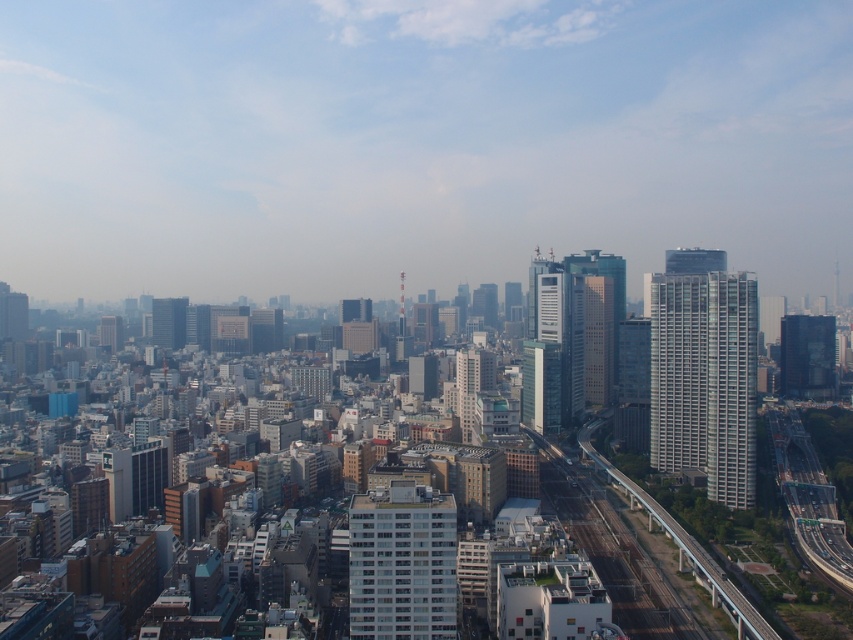
Question: Which point appears closest to the camera in this image?

Choices:
 (A) (160, 310)
 (B) (395, 497)
 (C) (653, 364)
 (D) (817, 342)

Answer: (B)

Question: Estimate the real-world distances between objects in this image. Which object is farther from the white glass building at right?

Choices:
 (A) dark glass skyscraper at right
 (B) matte glass skyscraper at left

Answer: (B)

Question: Is white smooth building at center smaller than dark glass skyscraper at right?

Choices:
 (A) no
 (B) yes

Answer: (B)

Question: Can you confirm if white smooth building at center is smaller than dark glass skyscraper at right?

Choices:
 (A) yes
 (B) no

Answer: (A)

Question: Which object appears closest to the camera in this image?

Choices:
 (A) white smooth building at center
 (B) matte glass skyscraper at left
 (C) dark glass skyscraper at right
 (D) white glass building at right

Answer: (A)

Question: Where is white glass building at right located in relation to white smooth building at center in the image?

Choices:
 (A) below
 (B) above

Answer: (B)